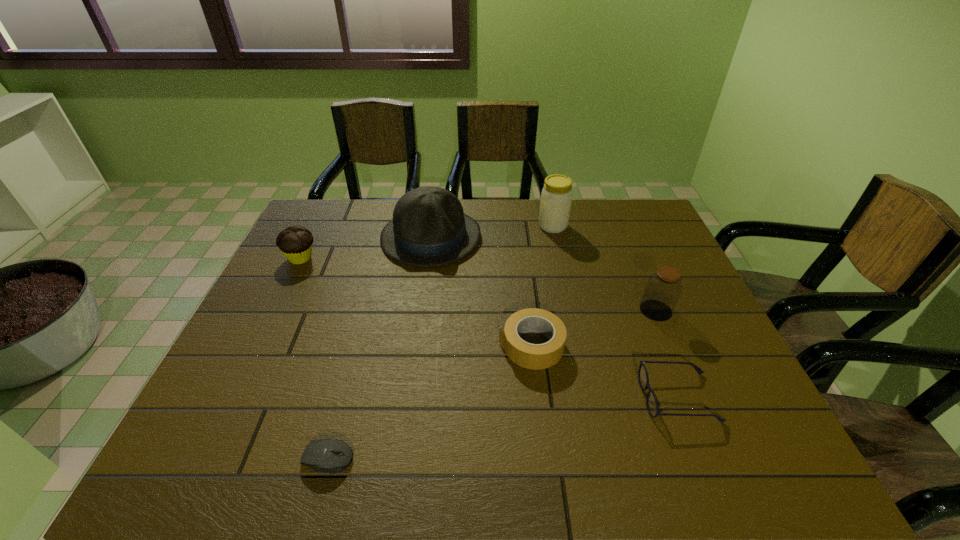
Locate an element on the screen. This screenshot has width=960, height=540. free space between the shorter jar and the shortest object is located at coordinates (492, 384).

Image resolution: width=960 pixels, height=540 pixels. Find the location of `free spot between the spectacles and the left jar`. free spot between the spectacles and the left jar is located at coordinates (615, 312).

Find the location of a particular element. free space between the bowler hat and the computer equipment is located at coordinates (379, 348).

The width and height of the screenshot is (960, 540). What are the coordinates of `object that ranks as the fifth closest to the spectacles` in the screenshot? It's located at (318, 455).

Where is `object that ranks as the third closest to the leftmost object`? This screenshot has height=540, width=960. object that ranks as the third closest to the leftmost object is located at coordinates (531, 356).

Where is `free space that satisfies the following two spatial constraints: 1. on the front-facing side of the sixth farthest object; 2. on the front side of the nearest object`? free space that satisfies the following two spatial constraints: 1. on the front-facing side of the sixth farthest object; 2. on the front side of the nearest object is located at coordinates (702, 458).

I want to click on free space that satisfies the following two spatial constraints: 1. on the back side of the left jar; 2. on the left side of the fourth shortest object, so click(317, 226).